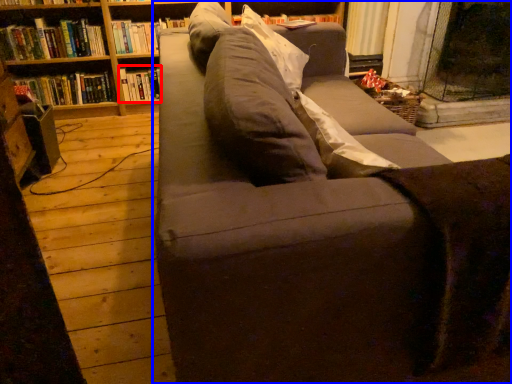
Question: Which of the following is the closest to the observer, book (highlighted by a red box) or studio couch (highlighted by a blue box)?

Choices:
 (A) book
 (B) studio couch

Answer: (B)